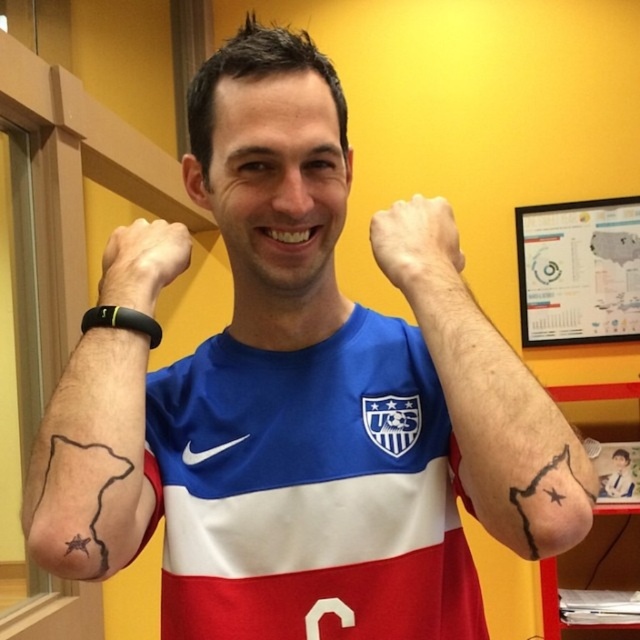
Question: Does black matte tattoo at upper left have a larger size compared to black rubber wristband at upper left?

Choices:
 (A) yes
 (B) no

Answer: (A)

Question: Which point is closer to the camera?

Choices:
 (A) (42, 444)
 (B) (227, 593)
 (C) (420, 275)
 (D) (497, 387)

Answer: (D)

Question: Is blue/white/red jersey at center closer to the viewer compared to black rubber wristband at upper left?

Choices:
 (A) no
 (B) yes

Answer: (A)

Question: Estimate the real-world distances between objects in this image. Which object is farther from the blue/white/red jersey at center?

Choices:
 (A) black ink bear at lower right
 (B) black matte tattoo at upper left
 (C) white matte hand at center
 (D) black ink tattoo at upper right

Answer: (A)

Question: Considering the relative positions of blue/white/red jersey at center and white matte hand at center in the image provided, where is blue/white/red jersey at center located with respect to white matte hand at center?

Choices:
 (A) left
 (B) right

Answer: (A)

Question: Estimate the real-world distances between objects in this image. Which object is farther from the blue/white/red jersey at center?

Choices:
 (A) black matte tattoo at upper left
 (B) black ink tattoo at upper right

Answer: (A)